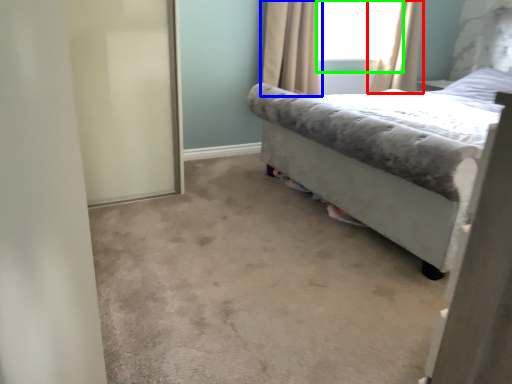
Question: Which is farther away from curtain (highlighted by a red box)? curtain (highlighted by a blue box) or window screen (highlighted by a green box)?

Choices:
 (A) curtain
 (B) window screen

Answer: (A)